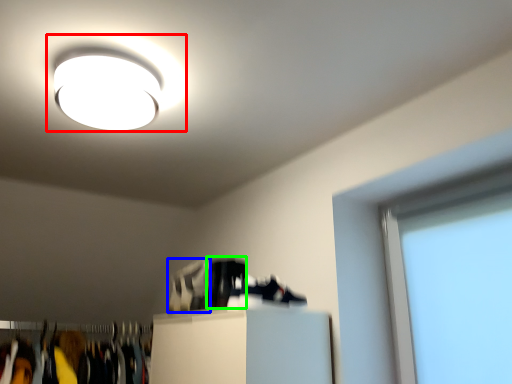
Question: Which object is positioned farthest from lamp (highlighted by a red box)? Select from shoe (highlighted by a blue box) and shoe (highlighted by a green box).

Choices:
 (A) shoe
 (B) shoe

Answer: (A)